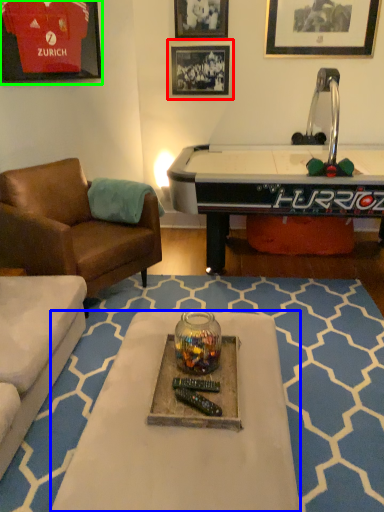
Question: Which object is positioned farthest from picture frame (highlighted by a red box)? Select from table (highlighted by a blue box) and picture frame (highlighted by a green box).

Choices:
 (A) table
 (B) picture frame

Answer: (A)